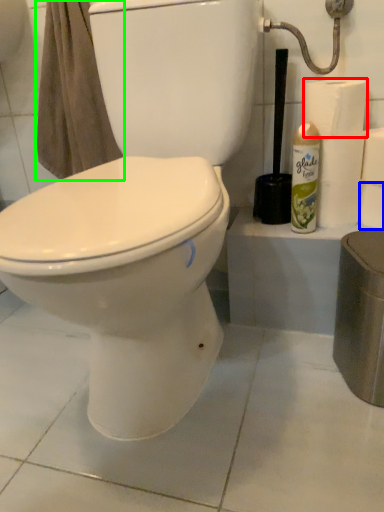
Question: Based on their relative distances, which object is farther from toilet paper (highlighted by a red box)? Choose from toilet paper (highlighted by a blue box) and bath towel (highlighted by a green box).

Choices:
 (A) toilet paper
 (B) bath towel

Answer: (B)